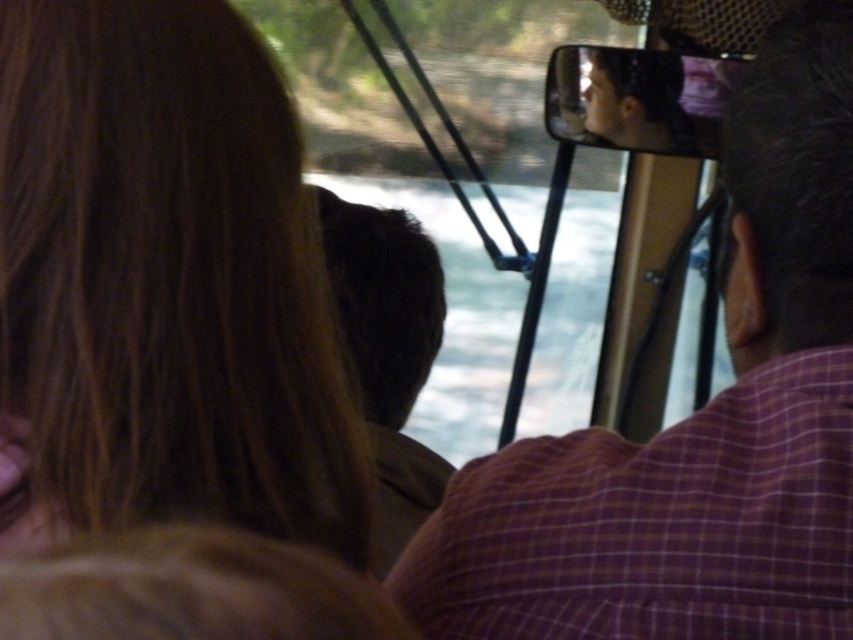
Who is positioned more to the left, purple checkered shirt at upper right or brown hair at center?

From the viewer's perspective, brown hair at center appears more on the left side.

At what (x,y) coordinates should I click in order to perform the action: click on purple checkered shirt at upper right. Please return your answer as a coordinate pair (x, y). The height and width of the screenshot is (640, 853). Looking at the image, I should click on (695, 424).

Is blonde hair at left above purple checkered shirt at upper right?

Yes, blonde hair at left is above purple checkered shirt at upper right.

Which is more to the right, blonde hair at left or purple checkered shirt at upper right?

purple checkered shirt at upper right is more to the right.

Looking at this image, who is more forward, (71, 406) or (659, 548)?

Point (71, 406)

Locate an element on the screen. The image size is (853, 640). blonde hair at left is located at coordinates (167, 278).

Who is more forward, (222, 138) or (373, 397)?

Point (222, 138) is more forward.

Does blonde hair at left appear on the right side of brown hair at center?

In fact, blonde hair at left is to the left of brown hair at center.

Who is more distant from viewer, (143, 339) or (405, 522)?

The point (405, 522) is behind.

This screenshot has width=853, height=640. I want to click on blonde hair at left, so click(x=167, y=278).